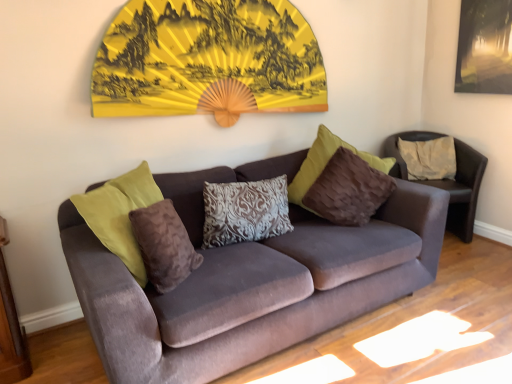
Describe the element at coordinates (485, 47) in the screenshot. I see `matte black picture frame at upper right` at that location.

What is the approximate width of velvet brown armchair at center?

22.29 inches.

Describe the element at coordinates (245, 211) in the screenshot. I see `patterned fabric pillow at center, the 2th pillow positioned from the front` at that location.

At what (x,y) coordinates should I click in order to perform the action: click on matte black picture frame at upper right. Please return your answer as a coordinate pair (x, y). The width and height of the screenshot is (512, 384). Looking at the image, I should click on (485, 47).

From the image's perspective, is beige fabric pillow at right, the 3th pillow when ordered from left to right, below brown velvety pillow at center, marked as the third pillow in a right-to-left arrangement?

Incorrect, from the image's perspective, beige fabric pillow at right, the 3th pillow when ordered from left to right, is higher than brown velvety pillow at center, marked as the third pillow in a right-to-left arrangement.

From the picture: Can brown velvety pillow at center, placed as the 1th pillow when sorted from front to back, be found inside beige fabric pillow at right, arranged as the 1th pillow when viewed from the right?

No, brown velvety pillow at center, placed as the 1th pillow when sorted from front to back, is located outside of beige fabric pillow at right, arranged as the 1th pillow when viewed from the right.

Is point (402, 149) positioned before point (167, 227)?

No.

Is beige fabric pillow at right, arranged as the 1th pillow when viewed from the right, wider than brown velvety pillow at center, placed as the 1th pillow when sorted from front to back?

Correct, the width of beige fabric pillow at right, arranged as the 1th pillow when viewed from the right, exceeds that of brown velvety pillow at center, placed as the 1th pillow when sorted from front to back.

In the scene shown: Considering the sizes of objects patterned fabric pillow at center, the second pillow viewed from the left, and matte black picture frame at upper right in the image provided, who is smaller, patterned fabric pillow at center, the second pillow viewed from the left, or matte black picture frame at upper right?

matte black picture frame at upper right.

From the image's perspective, is patterned fabric pillow at center, the 2th pillow positioned from the front, above or below matte black picture frame at upper right?

From the image's perspective, patterned fabric pillow at center, the 2th pillow positioned from the front, appears below matte black picture frame at upper right.

Is patterned fabric pillow at center, positioned as the 2th pillow in right-to-left order, looking in the opposite direction of matte black picture frame at upper right?

patterned fabric pillow at center, positioned as the 2th pillow in right-to-left order, is not turned away from matte black picture frame at upper right.

From the image's perspective, is brown velvety pillow at center, which appears as the 3th pillow when viewed from the back, located above or below velvet brown armchair at center?

Based on their image positions, brown velvety pillow at center, which appears as the 3th pillow when viewed from the back, is located beneath velvet brown armchair at center.

Identify the location of pillow that is the 2nd object located below the velvet brown armchair at center (from the image's perspective). (164, 245).

Consider the image. From a real-world perspective, which object rests below the other?

velvet brown armchair at center is physically lower.

Is brown velvety pillow at center, marked as the third pillow in a right-to-left arrangement, facing away from velvet brown armchair at center?

No, brown velvety pillow at center, marked as the third pillow in a right-to-left arrangement,'s orientation is not away from velvet brown armchair at center.

Is patterned fabric pillow at center, the second pillow viewed from the left, touching velvet couch at center?

There is a gap between patterned fabric pillow at center, the second pillow viewed from the left, and velvet couch at center.

Which is closer, (247, 215) or (376, 278)?

Point (376, 278)

Which of these two, patterned fabric pillow at center, the 2th pillow positioned from the front, or velvet couch at center, stands shorter?

With less height is patterned fabric pillow at center, the 2th pillow positioned from the front.

What are the coordinates of `studio couch located underneath the patterned fabric pillow at center, positioned as the 2th pillow in right-to-left order (from a real-world perspective)` in the screenshot? It's located at (250, 280).

How distant is beige fabric pillow at right, which is the first pillow from back to front, from velvet brown armchair at center?

beige fabric pillow at right, which is the first pillow from back to front, is 13.50 centimeters from velvet brown armchair at center.

Would you consider beige fabric pillow at right, the 3th pillow when ordered from left to right, to be distant from velvet brown armchair at center?

No, beige fabric pillow at right, the 3th pillow when ordered from left to right, is not far from velvet brown armchair at center.

Is velvet brown armchair at center at the back of beige fabric pillow at right, the third pillow in the front-to-back sequence?

Yes, beige fabric pillow at right, the third pillow in the front-to-back sequence,'s orientation is away from velvet brown armchair at center.

Is brown velvety pillow at center, which ranks as the 1th pillow in left-to-right order, turned away from yellow paper fan at upper center?

No, brown velvety pillow at center, which ranks as the 1th pillow in left-to-right order, is not facing the opposite direction of yellow paper fan at upper center.

From a real-world perspective, is brown velvety pillow at center, which ranks as the 1th pillow in left-to-right order, located higher than yellow paper fan at upper center?

No, from a real-world perspective, brown velvety pillow at center, which ranks as the 1th pillow in left-to-right order, is not on top of yellow paper fan at upper center.

From the image's perspective, is brown velvety pillow at center, which appears as the 3th pillow when viewed from the back, over yellow paper fan at upper center?

No.

This screenshot has height=384, width=512. I want to click on picture frame behind the yellow paper fan at upper center, so click(485, 47).

Consider the image. Is yellow paper fan at upper center far from matte black picture frame at upper right?

Yes, yellow paper fan at upper center is far from matte black picture frame at upper right.

Which of these two, yellow paper fan at upper center or matte black picture frame at upper right, stands taller?

With more height is yellow paper fan at upper center.

Is point (283, 52) farther from camera compared to point (471, 36)?

No, (283, 52) is closer to viewer.

You are a GUI agent. You are given a task and a screenshot of the screen. Output one action in this format:
    pyautogui.click(x=<x>, y=<y>)
    Task: Click on the pillow above the beige fabric pillow at right, arranged as the 1th pillow when viewed from the right (from a real-world perspective)
    
    Given the screenshot: What is the action you would take?
    pyautogui.click(x=164, y=245)

Locate an element on the screen. picture frame behind the patterned fabric pillow at center, acting as the second pillow starting from the back is located at coordinates (485, 47).

When comparing their distances from matte black picture frame at upper right, does yellow paper fan at upper center or velvet brown armchair at center seem closer?

velvet brown armchair at center is positioned closer to the anchor matte black picture frame at upper right.

Which object lies further to the anchor point matte black picture frame at upper right, beige fabric pillow at right, arranged as the 1th pillow when viewed from the right, or yellow paper fan at upper center?

The object further to matte black picture frame at upper right is yellow paper fan at upper center.

Based on their spatial positions, is velvet brown armchair at center or brown velvety pillow at center, which appears as the 3th pillow when viewed from the back, closer to yellow paper fan at upper center?

Among the two, brown velvety pillow at center, which appears as the 3th pillow when viewed from the back, is located nearer to yellow paper fan at upper center.

Looking at the image, which one is located closer to beige fabric pillow at right, the third pillow in the front-to-back sequence, patterned fabric pillow at center, acting as the second pillow starting from the back, or matte black picture frame at upper right?

Based on the image, matte black picture frame at upper right appears to be nearer to beige fabric pillow at right, the third pillow in the front-to-back sequence.

When comparing their distances from yellow paper fan at upper center, does matte black picture frame at upper right or beige fabric pillow at right, the third pillow in the front-to-back sequence, seem closer?

The object closer to yellow paper fan at upper center is beige fabric pillow at right, the third pillow in the front-to-back sequence.

Estimate the real-world distances between objects in this image. Which object is further from velvet brown armchair at center, yellow paper fan at upper center or beige fabric pillow at right, the third pillow in the front-to-back sequence?

yellow paper fan at upper center lies further to velvet brown armchair at center than the other object.

Based on their spatial positions, is velvet brown armchair at center or beige fabric pillow at right, which is the first pillow from back to front, further from velvet couch at center?

Among the two, beige fabric pillow at right, which is the first pillow from back to front, is located further to velvet couch at center.

From the image, which object appears to be farther from velvet couch at center, yellow paper fan at upper center or velvet brown armchair at center?

velvet brown armchair at center lies further to velvet couch at center than the other object.

At what (x,y) coordinates should I click in order to perform the action: click on studio couch between yellow paper fan at upper center and velvet brown armchair at center in the horizontal direction. Please return your answer as a coordinate pair (x, y). This screenshot has height=384, width=512. Looking at the image, I should click on (250, 280).

In order to click on pillow situated between brown velvety pillow at center, which ranks as the 1th pillow in left-to-right order, and beige fabric pillow at right, arranged as the 1th pillow when viewed from the right, from left to right in this screenshot , I will do `click(245, 211)`.

I want to click on pillow positioned between velvet couch at center and patterned fabric pillow at center, the second pillow viewed from the left, from near to far, so click(x=164, y=245).

Identify the location of chair between velvet couch at center and beige fabric pillow at right, which is the first pillow from back to front, along the z-axis. (463, 190).